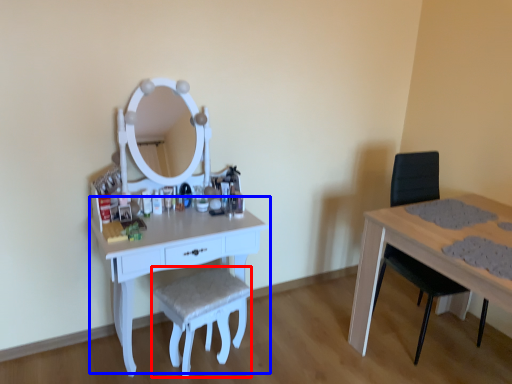
Question: Which object is closer to the camera taking this photo, stool (highlighted by a red box) or table (highlighted by a blue box)?

Choices:
 (A) stool
 (B) table

Answer: (B)